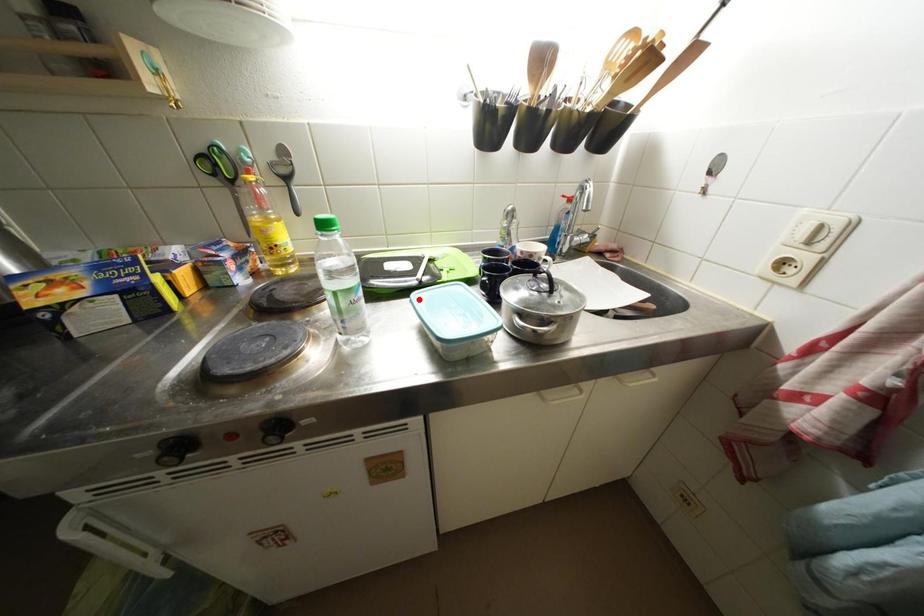
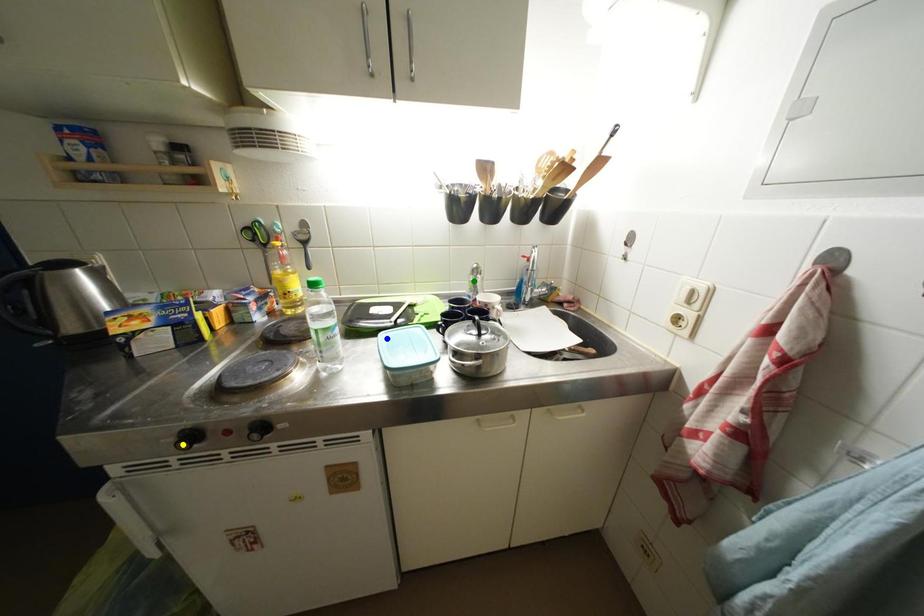
Question: I am providing you with two images of the same scene from different viewpoints. A red point is marked on the first image. You are given multiple points on the second image. Which point in image 2 is actually the same real-world point as the red point in image 1?

Choices:
 (A) blue point
 (B) yellow point
 (C) green point

Answer: (A)